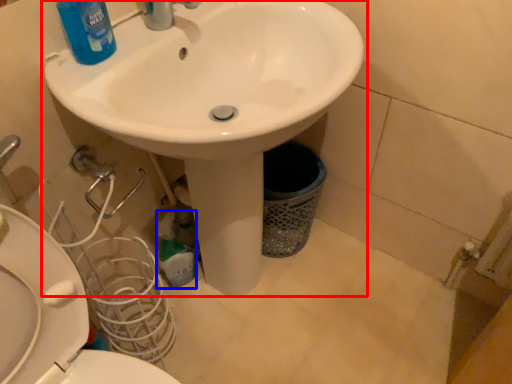
Question: Among these objects, which one is farthest to the camera, sink (highlighted by a red box) or cleaning product (highlighted by a blue box)?

Choices:
 (A) sink
 (B) cleaning product

Answer: (B)